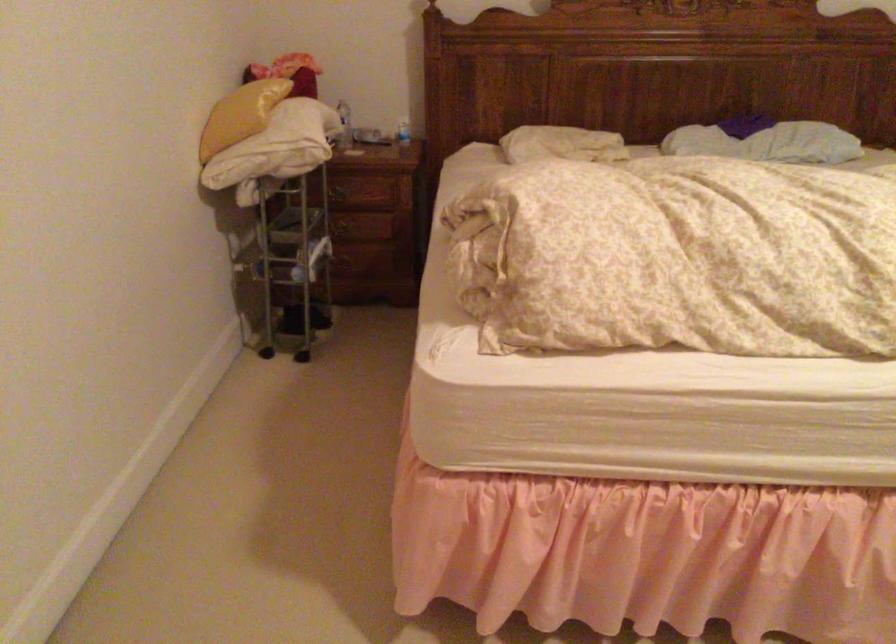
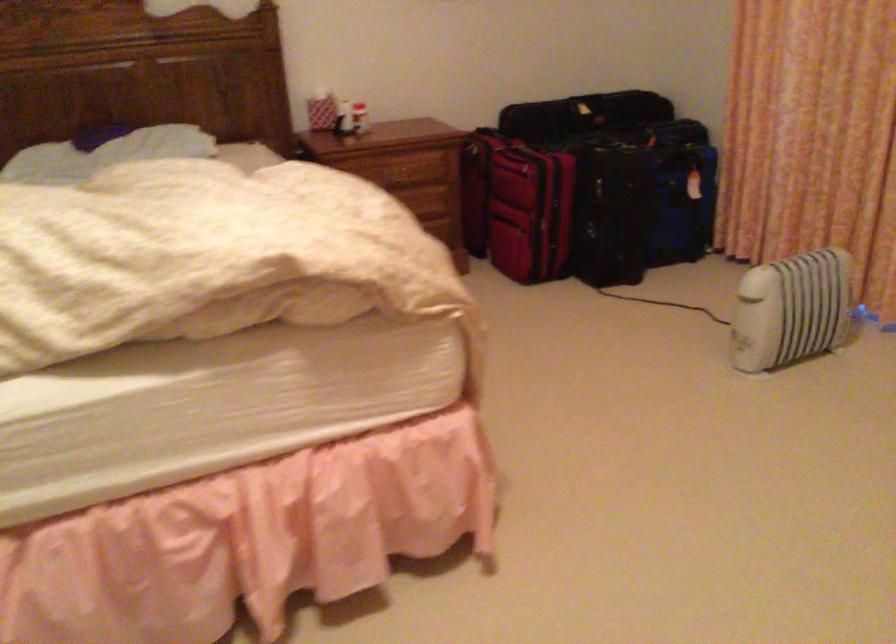
Question: The images are taken continuously from a first-person perspective. In which direction are you moving?

Choices:
 (A) Left
 (B) Right
 (C) Forward
 (D) Backward

Answer: (B)